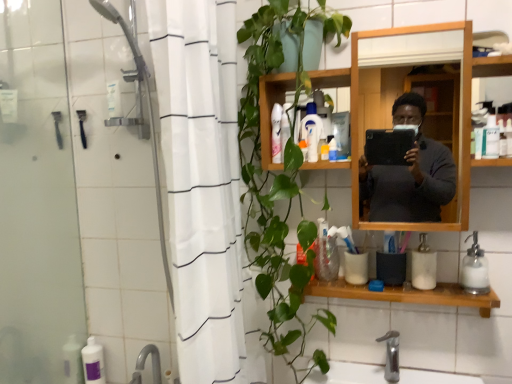
Locate an element on the screen. This screenshot has height=384, width=512. free space above wooden shelf at lower center (from a real-world perspective) is located at coordinates (377, 280).